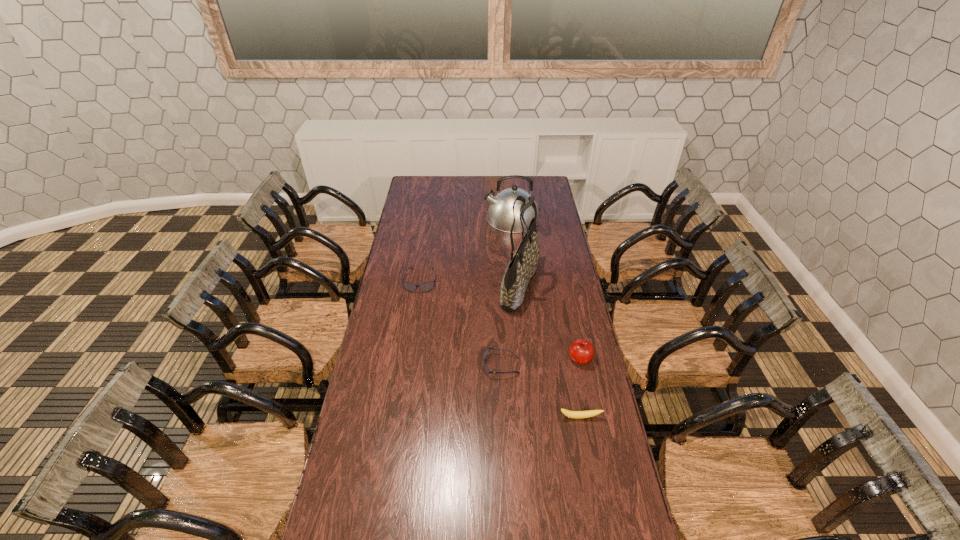
The image size is (960, 540). Identify the location of the farther sunglasses. (425, 287).

Identify the location of the left sunglasses. The height and width of the screenshot is (540, 960). (425, 287).

Where is `the nearer sunglasses`? The height and width of the screenshot is (540, 960). the nearer sunglasses is located at coordinates (487, 371).

Identify the location of the right sunglasses. This screenshot has width=960, height=540. (487, 371).

Find the location of a particular element. This screenshot has height=540, width=960. the fifth shortest object is located at coordinates (500, 215).

The width and height of the screenshot is (960, 540). In order to click on kettle in this screenshot , I will do `click(500, 215)`.

Locate an element on the screen. apple is located at coordinates point(581,351).

Where is `the tallest object`? the tallest object is located at coordinates (522, 267).

Find the location of a particular element. This screenshot has height=540, width=960. banana is located at coordinates (571, 414).

Locate an element on the screen. vacant space situated on the lenses of the farther sunglasses is located at coordinates (415, 320).